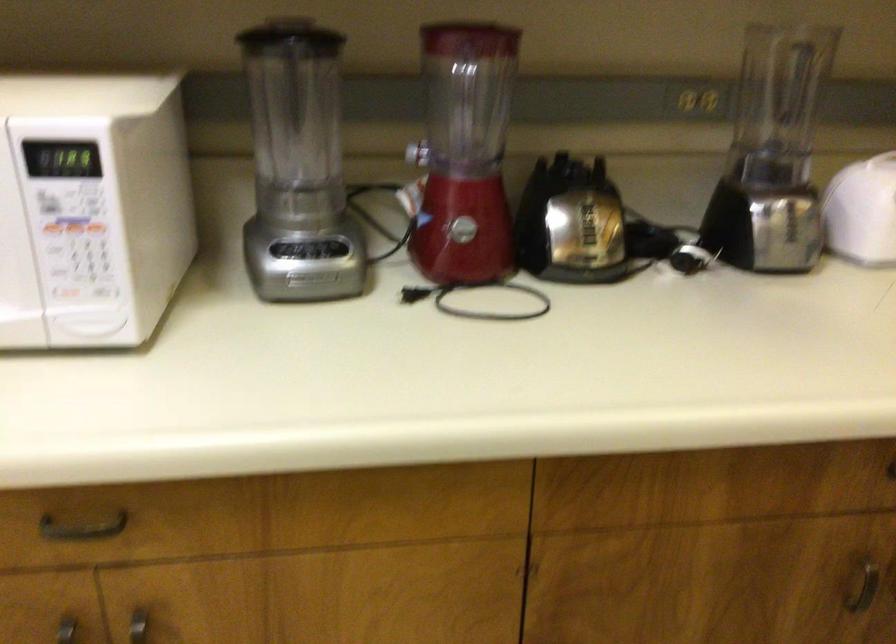
Find where to pull the dark drawer handle. Please return your answer as a coordinate pair (x, y).

(82, 527)